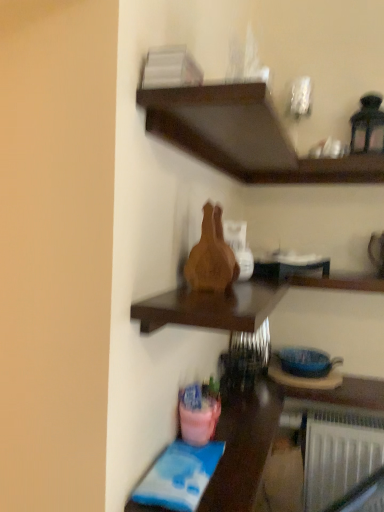
Where is `dark wood shelf at upper center, marked as the first shelf in a top-to-bottom arrangement`? dark wood shelf at upper center, marked as the first shelf in a top-to-bottom arrangement is located at coordinates (245, 136).

At what (x,y) coordinates should I click in order to perform the action: click on pink plastic bucket at lower left. Please return your answer as a coordinate pair (x, y). This screenshot has width=384, height=512. Looking at the image, I should click on (243, 446).

From a real-world perspective, who is located lower, wooden vase at center, arranged as the 2th shelf when viewed from the top, or dark wood shelf at upper center, marked as the first shelf in a top-to-bottom arrangement?

wooden vase at center, arranged as the 2th shelf when viewed from the top, from a real-world perspective.

Between wooden vase at center, arranged as the 2th shelf when viewed from the top, and dark wood shelf at upper center, marked as the first shelf in a top-to-bottom arrangement, which one has larger width?

Wider between the two is dark wood shelf at upper center, marked as the first shelf in a top-to-bottom arrangement.

Is wooden vase at center, which is the 1th shelf from bottom to top, aimed at dark wood shelf at upper center, marked as the first shelf in a top-to-bottom arrangement?

No, wooden vase at center, which is the 1th shelf from bottom to top, is not aimed at dark wood shelf at upper center, marked as the first shelf in a top-to-bottom arrangement.

In terms of height, does pink plastic bucket at lower left look taller or shorter compared to dark wood shelf at upper center, marked as the first shelf in a top-to-bottom arrangement?

Clearly, pink plastic bucket at lower left is taller compared to dark wood shelf at upper center, marked as the first shelf in a top-to-bottom arrangement.

Is pink plastic bucket at lower left not inside dark wood shelf at upper center, marked as the first shelf in a top-to-bottom arrangement?

Yes, pink plastic bucket at lower left is outside of dark wood shelf at upper center, marked as the first shelf in a top-to-bottom arrangement.

Based on the photo, is pink plastic bucket at lower left far away from dark wood shelf at upper center, positioned as the second shelf in bottom-to-top order?

pink plastic bucket at lower left is actually quite close to dark wood shelf at upper center, positioned as the second shelf in bottom-to-top order.

Where is `table located behind the wooden vase at center, which is the 1th shelf from bottom to top`? This screenshot has width=384, height=512. table located behind the wooden vase at center, which is the 1th shelf from bottom to top is located at coordinates (243, 446).

Which is closer, (x=254, y=479) or (x=243, y=315)?

Point (x=254, y=479).

Can you confirm if pink plastic bucket at lower left is thinner than wooden vase at center, arranged as the 2th shelf when viewed from the top?

Yes.

Is the position of pink plastic bucket at lower left more distant than that of wooden vase at center, arranged as the 2th shelf when viewed from the top?

Yes, pink plastic bucket at lower left is further from the camera.

Is dark wood shelf at upper center, marked as the first shelf in a top-to-bottom arrangement, positioned with its back to wooden vase at center, which is the 1th shelf from bottom to top?

No, dark wood shelf at upper center, marked as the first shelf in a top-to-bottom arrangement,'s orientation is not away from wooden vase at center, which is the 1th shelf from bottom to top.

What's the angular difference between dark wood shelf at upper center, marked as the first shelf in a top-to-bottom arrangement, and wooden vase at center, arranged as the 2th shelf when viewed from the top,'s facing directions?

dark wood shelf at upper center, marked as the first shelf in a top-to-bottom arrangement, and wooden vase at center, arranged as the 2th shelf when viewed from the top, are facing 6.91e-05 degrees away from each other.

Is dark wood shelf at upper center, positioned as the second shelf in bottom-to-top order, taller or shorter than wooden vase at center, which is the 1th shelf from bottom to top?

Clearly, dark wood shelf at upper center, positioned as the second shelf in bottom-to-top order, is shorter compared to wooden vase at center, which is the 1th shelf from bottom to top.

Based on the photo, would you consider dark wood shelf at upper center, positioned as the second shelf in bottom-to-top order, to be distant from wooden vase at center, which is the 1th shelf from bottom to top?

No, dark wood shelf at upper center, positioned as the second shelf in bottom-to-top order, is in close proximity to wooden vase at center, which is the 1th shelf from bottom to top.

Can you confirm if dark wood shelf at upper center, marked as the first shelf in a top-to-bottom arrangement, is shorter than pink plastic bucket at lower left?

Yes.

Which object is closer to the camera taking this photo, dark wood shelf at upper center, positioned as the second shelf in bottom-to-top order, or pink plastic bucket at lower left?

dark wood shelf at upper center, positioned as the second shelf in bottom-to-top order, is more forward.

Where is `shelf that is the 2nd one above the pink plastic bucket at lower left (from a real-world perspective)`? The width and height of the screenshot is (384, 512). shelf that is the 2nd one above the pink plastic bucket at lower left (from a real-world perspective) is located at coordinates (245, 136).

Is wooden vase at center, which is the 1th shelf from bottom to top, further to the viewer compared to pink plastic bucket at lower left?

No, it is in front of pink plastic bucket at lower left.

Is wooden vase at center, which is the 1th shelf from bottom to top, far away from pink plastic bucket at lower left?

No, wooden vase at center, which is the 1th shelf from bottom to top, is not far from pink plastic bucket at lower left.

Considering the points (219, 323) and (251, 476), which point is in front, point (219, 323) or point (251, 476)?

The point (219, 323) is closer.

From the pink plastic bucket at lower left, count 1st shelf to the right and point to it. Please provide its 2D coordinates.

[(237, 302)]

Locate an element on the screen. The image size is (384, 512). shelf below the dark wood shelf at upper center, positioned as the second shelf in bottom-to-top order (from the image's perspective) is located at coordinates (237, 302).

Where is `the 2nd shelf in front of the pink plastic bucket at lower left, counting from the anchor's position`? The width and height of the screenshot is (384, 512). the 2nd shelf in front of the pink plastic bucket at lower left, counting from the anchor's position is located at coordinates (245, 136).

Estimate the real-world distances between objects in this image. Which object is further from pink plastic bucket at lower left, wooden vase at center, which is the 1th shelf from bottom to top, or dark wood shelf at upper center, marked as the first shelf in a top-to-bottom arrangement?

Among the two, dark wood shelf at upper center, marked as the first shelf in a top-to-bottom arrangement, is located further to pink plastic bucket at lower left.

Estimate the real-world distances between objects in this image. Which object is further from dark wood shelf at upper center, marked as the first shelf in a top-to-bottom arrangement, wooden vase at center, arranged as the 2th shelf when viewed from the top, or pink plastic bucket at lower left?

Among the two, pink plastic bucket at lower left is located further to dark wood shelf at upper center, marked as the first shelf in a top-to-bottom arrangement.

Estimate the real-world distances between objects in this image. Which object is further from dark wood shelf at upper center, positioned as the second shelf in bottom-to-top order, pink plastic bucket at lower left or wooden vase at center, which is the 1th shelf from bottom to top?

pink plastic bucket at lower left.

Looking at the image, which one is located closer to wooden vase at center, arranged as the 2th shelf when viewed from the top, pink plastic bucket at lower left or dark wood shelf at upper center, positioned as the second shelf in bottom-to-top order?

pink plastic bucket at lower left is closer to wooden vase at center, arranged as the 2th shelf when viewed from the top.

Estimate the real-world distances between objects in this image. Which object is further from wooden vase at center, arranged as the 2th shelf when viewed from the top, dark wood shelf at upper center, positioned as the second shelf in bottom-to-top order, or pink plastic bucket at lower left?

Based on the image, dark wood shelf at upper center, positioned as the second shelf in bottom-to-top order, appears to be further to wooden vase at center, arranged as the 2th shelf when viewed from the top.

When comparing their distances from pink plastic bucket at lower left, does dark wood shelf at upper center, positioned as the second shelf in bottom-to-top order, or wooden vase at center, which is the 1th shelf from bottom to top, seem further?

Among the two, dark wood shelf at upper center, positioned as the second shelf in bottom-to-top order, is located further to pink plastic bucket at lower left.

Image resolution: width=384 pixels, height=512 pixels. Find the location of `shelf between dark wood shelf at upper center, positioned as the second shelf in bottom-to-top order, and pink plastic bucket at lower left in the up-down direction`. shelf between dark wood shelf at upper center, positioned as the second shelf in bottom-to-top order, and pink plastic bucket at lower left in the up-down direction is located at coordinates (237, 302).